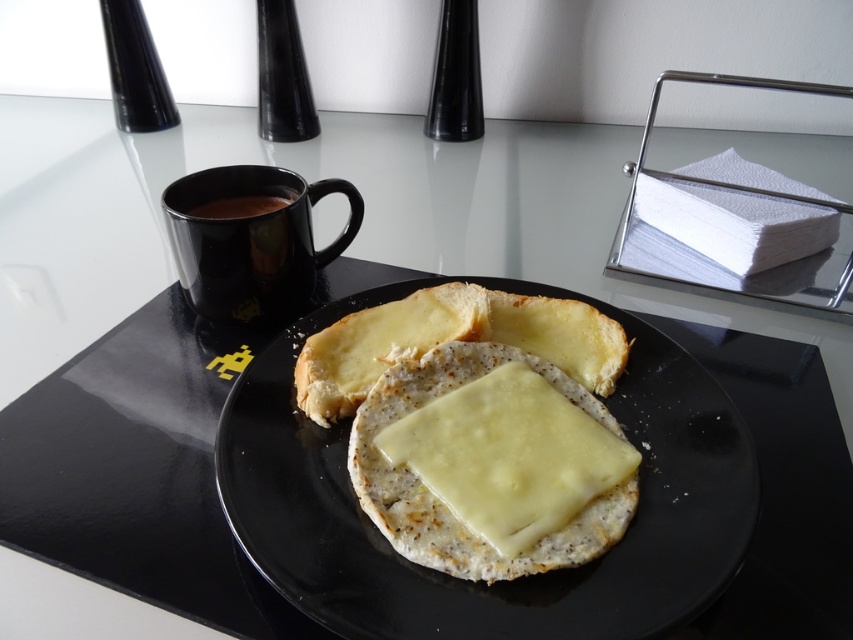
Question: Does matte black plate at center lie behind black glossy mug at upper left?

Choices:
 (A) no
 (B) yes

Answer: (A)

Question: Which object is positioned farthest from the black glossy mug at upper left?

Choices:
 (A) yellowish matte cheese at center
 (B) black matte mug at left
 (C) matte black plate at center

Answer: (A)

Question: Estimate the real-world distances between objects in this image. Which object is closer to the yellowish matte cheese at center?

Choices:
 (A) black glossy mug at upper left
 (B) black matte mug at left
 (C) matte black plate at center

Answer: (C)

Question: Estimate the real-world distances between objects in this image. Which object is farther from the black glossy mug at upper left?

Choices:
 (A) yellowish matte cheese at center
 (B) matte black plate at center
 (C) black matte mug at left

Answer: (A)

Question: In this image, where is black matte mug at left located relative to black glossy mug at upper left?

Choices:
 (A) below
 (B) above

Answer: (A)

Question: Where is yellowish matte cheese at center located in relation to black glossy mug at upper left in the image?

Choices:
 (A) left
 (B) right

Answer: (B)